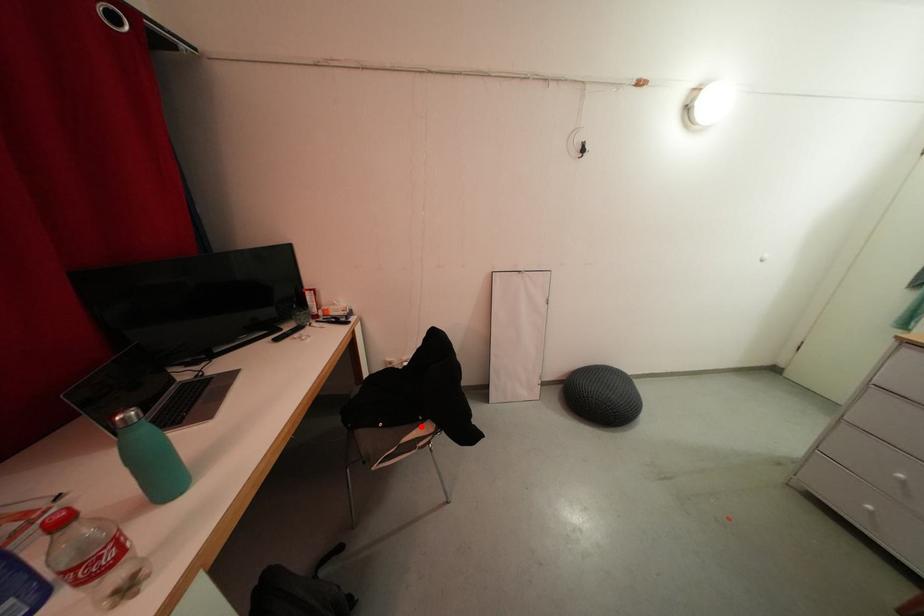
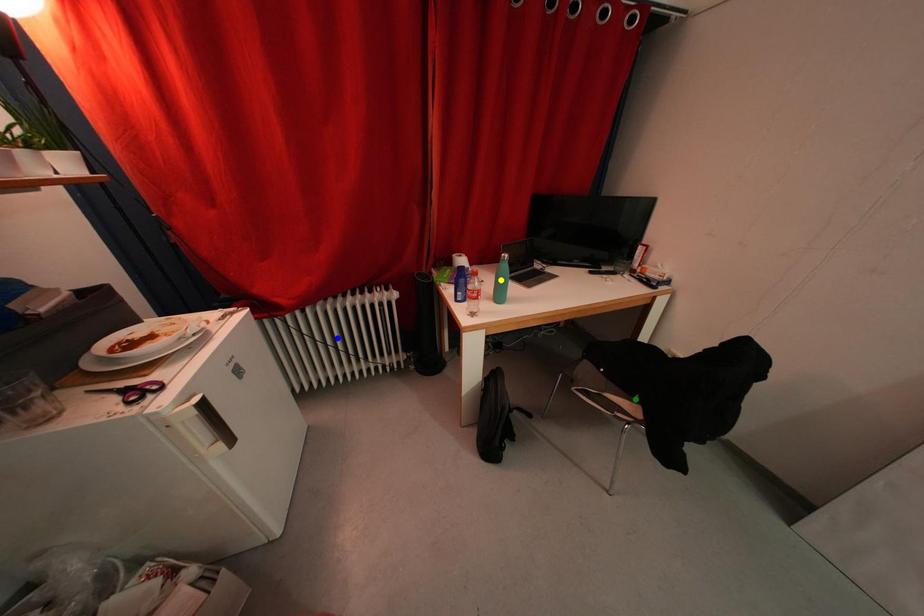
Question: I am providing you with two images of the same scene from different viewpoints. A red point is marked on the first image. You are given multiple points on the second image. Which mark in image 2 goes with the point in image 1?

Choices:
 (A) blue point
 (B) green point
 (C) yellow point

Answer: (B)